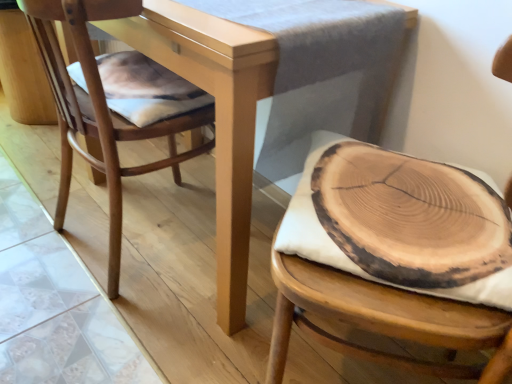
The height and width of the screenshot is (384, 512). What do you see at coordinates (384, 320) in the screenshot?
I see `wooden cushion at right, the first chair viewed from the right` at bounding box center [384, 320].

Measure the distance between point (66, 173) and camera.

4.39 feet.

Where is `matte wood table at center`? The image size is (512, 384). matte wood table at center is located at coordinates (216, 117).

From the image's perspective, which is below, natural wood chair at left, which is the first chair in left-to-right order, or matte wood table at center?

natural wood chair at left, which is the first chair in left-to-right order, from the image's perspective.

Considering the sizes of natural wood chair at left, which is the first chair in left-to-right order, and matte wood table at center in the image, is natural wood chair at left, which is the first chair in left-to-right order, bigger or smaller than matte wood table at center?

Clearly, natural wood chair at left, which is the first chair in left-to-right order, is smaller in size than matte wood table at center.

Can you confirm if natural wood chair at left, acting as the second chair starting from the right, is positioned to the right of matte wood table at center?

No, natural wood chair at left, acting as the second chair starting from the right, is not to the right of matte wood table at center.

Between point (110, 22) and point (281, 311), which one is positioned behind?

The point (110, 22) is more distant.

Is matte wood table at center next to wooden cushion at right, which appears as the second chair when viewed from the left, and touching it?

matte wood table at center and wooden cushion at right, which appears as the second chair when viewed from the left, are not in contact.

From a real-world perspective, between matte wood table at center and wooden cushion at right, which appears as the second chair when viewed from the left, who is vertically lower?

matte wood table at center is physically lower.

In terms of size, does natural wood chair at left, which is the first chair in left-to-right order, appear bigger or smaller than natural wood slice at center?

Clearly, natural wood chair at left, which is the first chair in left-to-right order, is larger in size than natural wood slice at center.

Consider the image. From the image's perspective, is natural wood chair at left, which is the first chair in left-to-right order, beneath natural wood slice at center?

No, from the image's perspective, natural wood chair at left, which is the first chair in left-to-right order, is not below natural wood slice at center.

Is natural wood chair at left, acting as the second chair starting from the right, aimed at natural wood slice at center?

No, natural wood chair at left, acting as the second chair starting from the right, is not oriented towards natural wood slice at center.

How far apart are wooden cushion at right, the first chair viewed from the right, and natural wood slice at center?

wooden cushion at right, the first chair viewed from the right, and natural wood slice at center are 16.84 centimeters apart from each other.

Which object is positioned more to the right, wooden cushion at right, which appears as the second chair when viewed from the left, or natural wood slice at center?

wooden cushion at right, which appears as the second chair when viewed from the left.

Is wooden cushion at right, which appears as the second chair when viewed from the left, taller than natural wood slice at center?

Yes, wooden cushion at right, which appears as the second chair when viewed from the left, is taller than natural wood slice at center.

Which of these two, natural wood slice at center or wooden cushion at right, the first chair viewed from the right, is bigger?

With larger size is wooden cushion at right, the first chair viewed from the right.

Which is behind, point (407, 215) or point (456, 325)?

The point (407, 215) is behind.

Is natural wood slice at center not within wooden cushion at right, the first chair viewed from the right?

Actually, natural wood slice at center is within wooden cushion at right, the first chair viewed from the right.

Consider the image. Can you confirm if natural wood slice at center is shorter than wooden cushion at right, which appears as the second chair when viewed from the left?

Correct, natural wood slice at center is not as tall as wooden cushion at right, which appears as the second chair when viewed from the left.

Does natural wood slice at center have a greater width compared to natural wood chair at left, acting as the second chair starting from the right?

Incorrect, the width of natural wood slice at center does not surpass that of natural wood chair at left, acting as the second chair starting from the right.

In the scene shown: From a real-world perspective, is natural wood slice at center located beneath natural wood chair at left, acting as the second chair starting from the right?

No, from a real-world perspective, natural wood slice at center is not below natural wood chair at left, acting as the second chair starting from the right.

Is point (379, 158) farther from viewer compared to point (76, 41)?

Yes, it is behind point (76, 41).

Considering the relative positions of natural wood slice at center and matte wood table at center in the image provided, is natural wood slice at center to the right of matte wood table at center from the viewer's perspective?

Yes.

Which of these two, natural wood slice at center or matte wood table at center, is bigger?

With larger size is matte wood table at center.

In the image, there is a natural wood chair at left, which is the first chair in left-to-right order. Where is `table above it (from the image's perspective)`? This screenshot has width=512, height=384. table above it (from the image's perspective) is located at coordinates (216, 117).

The height and width of the screenshot is (384, 512). In order to click on table that is on the left side of wooden cushion at right, which appears as the second chair when viewed from the left in this screenshot , I will do `click(216, 117)`.

Looking at the image, which one is located closer to wooden cushion at right, which appears as the second chair when viewed from the left, natural wood slice at center or natural wood chair at left, which is the first chair in left-to-right order?

natural wood slice at center is positioned closer to the anchor wooden cushion at right, which appears as the second chair when viewed from the left.

From the image, which object appears to be nearer to wooden cushion at right, the first chair viewed from the right, matte wood table at center or natural wood chair at left, acting as the second chair starting from the right?

matte wood table at center is positioned closer to the anchor wooden cushion at right, the first chair viewed from the right.

Based on their spatial positions, is matte wood table at center or wooden cushion at right, the first chair viewed from the right, closer to natural wood chair at left, which is the first chair in left-to-right order?

Among the two, matte wood table at center is located nearer to natural wood chair at left, which is the first chair in left-to-right order.

When comparing their distances from natural wood slice at center, does natural wood chair at left, acting as the second chair starting from the right, or matte wood table at center seem further?

natural wood chair at left, acting as the second chair starting from the right, is positioned further to the anchor natural wood slice at center.

Based on their spatial positions, is wooden cushion at right, which appears as the second chair when viewed from the left, or matte wood table at center closer to natural wood chair at left, which is the first chair in left-to-right order?

Among the two, matte wood table at center is located nearer to natural wood chair at left, which is the first chair in left-to-right order.

From the image, which object appears to be nearer to matte wood table at center, wooden cushion at right, which appears as the second chair when viewed from the left, or natural wood slice at center?

natural wood slice at center is closer to matte wood table at center.

When comparing their distances from matte wood table at center, does wooden cushion at right, which appears as the second chair when viewed from the left, or natural wood chair at left, acting as the second chair starting from the right, seem further?

The object further to matte wood table at center is wooden cushion at right, which appears as the second chair when viewed from the left.

Which object lies nearer to the anchor point natural wood chair at left, acting as the second chair starting from the right, matte wood table at center or natural wood slice at center?

Based on the image, matte wood table at center appears to be nearer to natural wood chair at left, acting as the second chair starting from the right.

Find the location of a particular element. food between matte wood table at center and wooden cushion at right, which appears as the second chair when viewed from the left, from left to right is located at coordinates (410, 217).

Find the location of a particular element. table situated between natural wood chair at left, which is the first chair in left-to-right order, and wooden cushion at right, which appears as the second chair when viewed from the left, from left to right is located at coordinates (216, 117).

You are a GUI agent. You are given a task and a screenshot of the screen. Output one action in this format:
    pyautogui.click(x=<x>, y=<y>)
    Task: Click on the food situated between natural wood chair at left, which is the first chair in left-to-right order, and wooden cushion at right, which appears as the second chair when viewed from the left, from left to right
    
    Given the screenshot: What is the action you would take?
    pyautogui.click(x=410, y=217)

Find the location of a particular element. The height and width of the screenshot is (384, 512). table between natural wood chair at left, acting as the second chair starting from the right, and natural wood slice at center from left to right is located at coordinates (216, 117).